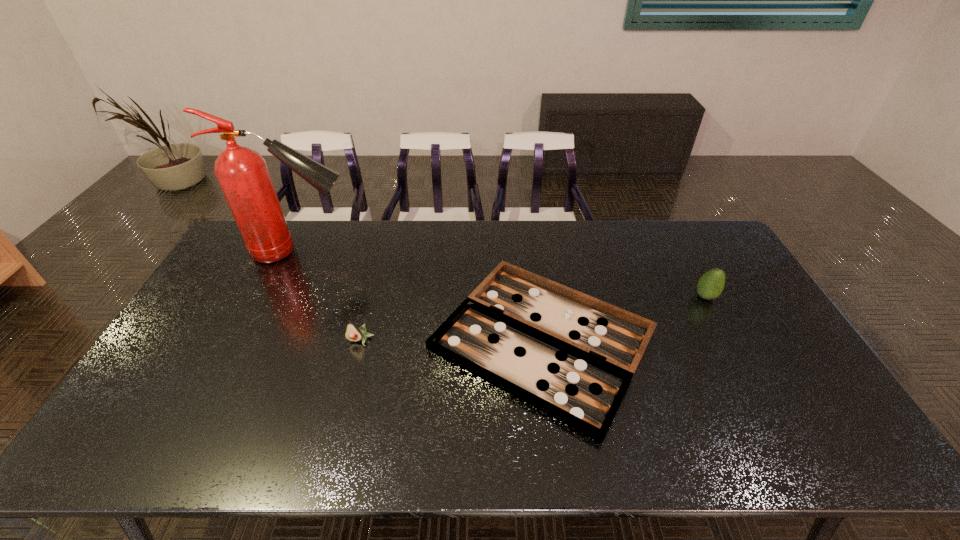
Locate an element on the screen. The width and height of the screenshot is (960, 540). free point that satisfies the following two spatial constraints: 1. at the nozzle end of the tallest object; 2. on the left side of the second object from right to left is located at coordinates (257, 340).

Find the location of a particular element. vacant space that satisfies the following two spatial constraints: 1. at the nozzle end of the fire extinguisher; 2. on the right side of the right avocado is located at coordinates (278, 296).

Where is `free space that satisfies the following two spatial constraints: 1. at the nozzle end of the leftmost object; 2. on the left side of the shortest object`? This screenshot has height=540, width=960. free space that satisfies the following two spatial constraints: 1. at the nozzle end of the leftmost object; 2. on the left side of the shortest object is located at coordinates (257, 340).

I want to click on vacant space that satisfies the following two spatial constraints: 1. at the nozzle end of the farthest object; 2. on the back side of the shortest object, so click(x=257, y=340).